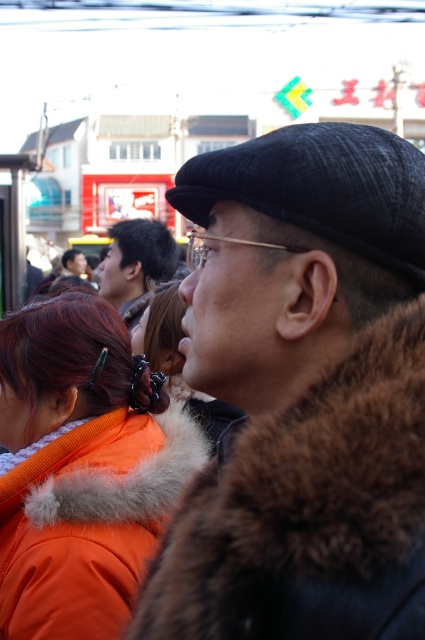
Question: Which object is closer to the camera taking this photo?

Choices:
 (A) fur-lined jacket at center
 (B) orange fur coat at center

Answer: (A)

Question: In this image, where is orange fur coat at center located relative to dark brown hair at center?

Choices:
 (A) above
 (B) below

Answer: (B)

Question: Which point is farther from the camera taking this photo?

Choices:
 (A) (62, 595)
 (B) (314, 536)

Answer: (A)

Question: Which object appears farthest from the camera in this image?

Choices:
 (A) dark brown hair at center
 (B) orange fur coat at center

Answer: (A)

Question: Observing the image, what is the correct spatial positioning of orange fur coat at center in reference to dark brown hair at center?

Choices:
 (A) right
 (B) left

Answer: (A)

Question: Does fur-lined jacket at center appear under orange fur coat at center?

Choices:
 (A) yes
 (B) no

Answer: (B)